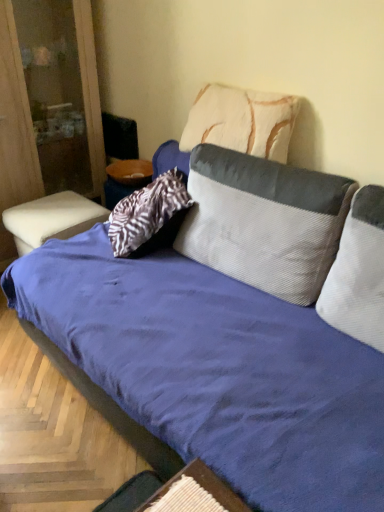
Question: Does white textured pillow at upper center, positioned as the 1th pillow in top-to-bottom order, have a lesser height compared to wooden textured table at lower center, the second table in the top-to-bottom sequence?

Choices:
 (A) no
 (B) yes

Answer: (A)

Question: Can you confirm if white textured pillow at upper center, positioned as the 1th pillow in top-to-bottom order, is bigger than wooden textured table at lower center, the 1th table when ordered from front to back?

Choices:
 (A) no
 (B) yes

Answer: (B)

Question: Considering the relative sizes of white textured pillow at upper center, the 3th pillow ordered from the bottom, and wooden textured table at lower center, arranged as the 2th table when viewed from the back, in the image provided, is white textured pillow at upper center, the 3th pillow ordered from the bottom, thinner than wooden textured table at lower center, arranged as the 2th table when viewed from the back,?

Choices:
 (A) yes
 (B) no

Answer: (A)

Question: From the image's perspective, is white textured pillow at upper center, positioned as the 1th pillow in top-to-bottom order, on wooden textured table at lower center, the second table in the top-to-bottom sequence?

Choices:
 (A) yes
 (B) no

Answer: (A)

Question: Considering the relative positions of white textured pillow at upper center, the 3th pillow ordered from the bottom, and wooden textured table at lower center, the 1th table from the bottom, in the image provided, is white textured pillow at upper center, the 3th pillow ordered from the bottom, to the right of wooden textured table at lower center, the 1th table from the bottom, from the viewer's perspective?

Choices:
 (A) no
 (B) yes

Answer: (B)

Question: From a real-world perspective, is white leather ottoman at lower left, acting as the 1th table starting from the left, above or below corduroy gray pillow at center, which ranks as the 2th pillow in top-to-bottom order?

Choices:
 (A) below
 (B) above

Answer: (A)

Question: Is white leather ottoman at lower left, placed as the second table when sorted from front to back, taller or shorter than corduroy gray pillow at center, which ranks as the 2th pillow in top-to-bottom order?

Choices:
 (A) short
 (B) tall

Answer: (A)

Question: Do you think white leather ottoman at lower left, the first table positioned from the top, is within corduroy gray pillow at center, which appears as the second pillow when ordered from the bottom, or outside of it?

Choices:
 (A) inside
 (B) outside

Answer: (B)

Question: Is white leather ottoman at lower left, which ranks as the 2th table in right-to-left order, wider or thinner than corduroy gray pillow at center, which ranks as the 2th pillow in top-to-bottom order?

Choices:
 (A) thin
 (B) wide

Answer: (B)

Question: From the image's perspective, is white leather ottoman at left located above or below wooden textured table at lower center, the second table in the top-to-bottom sequence?

Choices:
 (A) below
 (B) above

Answer: (B)

Question: From their relative heights in the image, would you say white leather ottoman at left is taller or shorter than wooden textured table at lower center, positioned as the 2th table in left-to-right order?

Choices:
 (A) tall
 (B) short

Answer: (A)

Question: In the image, is white leather ottoman at left positioned in front of or behind wooden textured table at lower center, arranged as the 2th table when viewed from the back?

Choices:
 (A) front
 (B) behind

Answer: (B)

Question: Is point (1, 57) closer or farther from the camera than point (220, 493)?

Choices:
 (A) farther
 (B) closer

Answer: (A)

Question: From a real-world perspective, is white textured pillow at upper center, positioned as the 1th pillow in top-to-bottom order, positioned above or below white leather ottoman at left?

Choices:
 (A) above
 (B) below

Answer: (A)

Question: Is white textured pillow at upper center, positioned as the 1th pillow in top-to-bottom order, to the left or to the right of white leather ottoman at left in the image?

Choices:
 (A) left
 (B) right

Answer: (B)